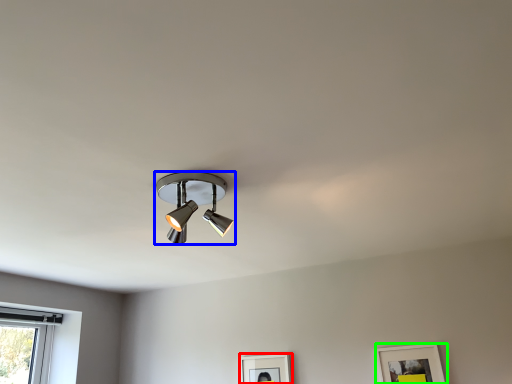
Question: Based on their relative distances, which object is farther from picture frame (highlighted by a red box)? Choose from lamp (highlighted by a blue box) and picture frame (highlighted by a green box).

Choices:
 (A) lamp
 (B) picture frame

Answer: (A)